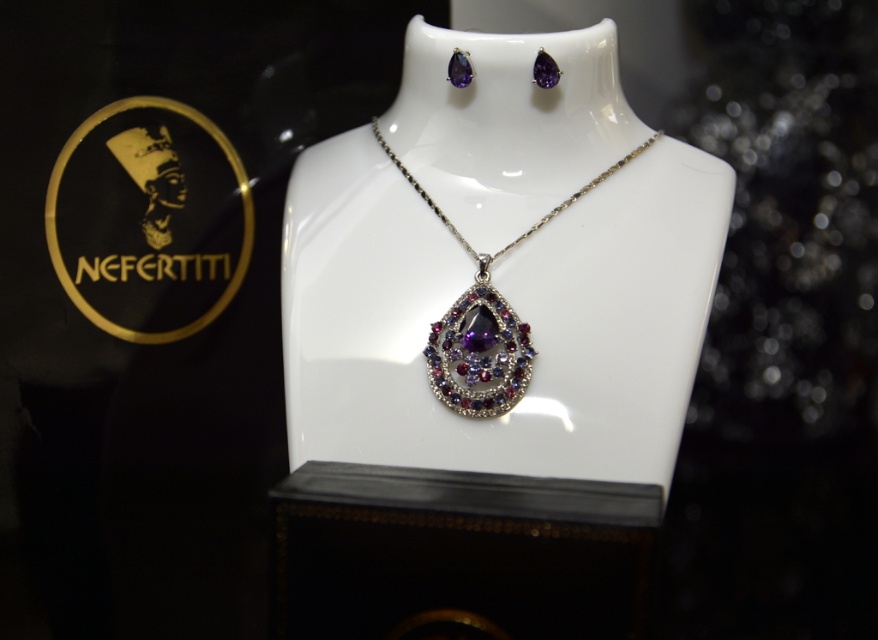
In the scene shown: Can you confirm if amber purple gemstone at upper center is positioned above amethyst gemstone at upper center?

Incorrect, amber purple gemstone at upper center is not positioned above amethyst gemstone at upper center.

Where is `amber purple gemstone at upper center`? The image size is (878, 640). amber purple gemstone at upper center is located at coordinates (545, 68).

Measure the distance between point (553, 68) and camera.

They are 1.01 meters apart.

Identify the location of amber purple gemstone at upper center. (545, 68).

Which is more to the right, gold/engraved logo at upper left or shiny silver necklace with purple gemstone at center?

shiny silver necklace with purple gemstone at center

Does gold/engraved logo at upper left come behind shiny silver necklace with purple gemstone at center?

Yes, it is.

Is point (65, 164) positioned behind point (483, 314)?

That is True.

Where is `gold/engraved logo at upper left`? gold/engraved logo at upper left is located at coordinates (149, 220).

Between gold/engraved logo at upper left and amber purple gemstone at upper center, which one appears on the right side from the viewer's perspective?

amber purple gemstone at upper center is more to the right.

Can you confirm if gold/engraved logo at upper left is bigger than amber purple gemstone at upper center?

Yes, gold/engraved logo at upper left is bigger than amber purple gemstone at upper center.

Who is more distant from viewer, (192,118) or (547,88)?

Positioned behind is point (192,118).

Identify the location of gold/engraved logo at upper left. This screenshot has height=640, width=878. (149, 220).